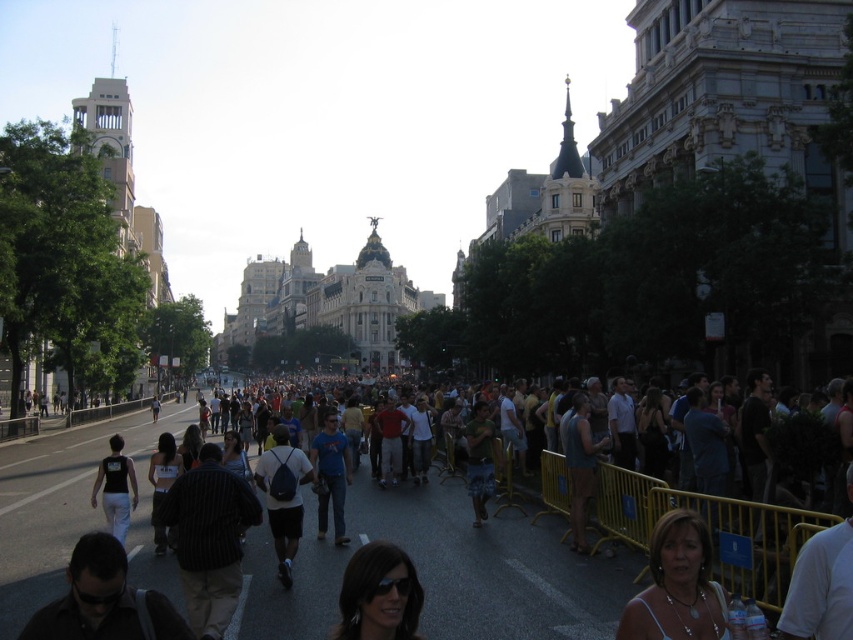
What do you see at coordinates (444, 570) in the screenshot? I see `matte white shirt at center` at bounding box center [444, 570].

Can you confirm if matte white shirt at center is smaller than green fabric shirt at center?

Incorrect, matte white shirt at center is not smaller in size than green fabric shirt at center.

Who is more forward, (293, 618) or (479, 522)?

Positioned in front is point (293, 618).

Where is `matte white shirt at center`? This screenshot has width=853, height=640. matte white shirt at center is located at coordinates (444, 570).

Between matte black sunglasses at center and green fabric shirt at center, which one has less height?

Standing shorter between the two is matte black sunglasses at center.

Who is positioned more to the right, matte black sunglasses at center or green fabric shirt at center?

From the viewer's perspective, green fabric shirt at center appears more on the right side.

You are a GUI agent. You are given a task and a screenshot of the screen. Output one action in this format:
    pyautogui.click(x=<x>, y=<y>)
    Task: Click on the matte black sunglasses at center
    The image size is (853, 640).
    Given the screenshot: What is the action you would take?
    pyautogui.click(x=379, y=595)

This screenshot has width=853, height=640. I want to click on matte black sunglasses at center, so click(x=379, y=595).

Is matte white shirt at center below white fabric dress at center?

Correct, matte white shirt at center is located below white fabric dress at center.

Is matte white shirt at center positioned in front of white fabric dress at center?

Yes, it is.

Is point (598, 593) positioned in front of point (163, 548)?

Yes, it is in front of point (163, 548).

Where is `matte white shirt at center`? The height and width of the screenshot is (640, 853). matte white shirt at center is located at coordinates (444, 570).